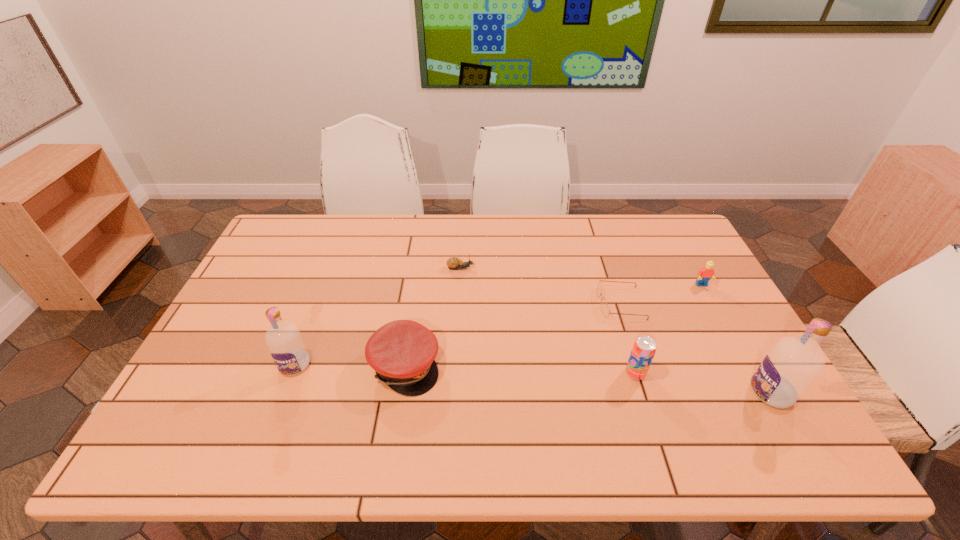
Find the location of a particular element. free area in between the spectacles and the soda can is located at coordinates (628, 338).

Choose which object is the fourth nearest neighbor to the taller vodka. Please provide its 2D coordinates. Your answer should be formatted as a tuple, i.e. [(x, y)], where the tuple contains the x and y coordinates of a point satisfying the conditions above.

[(402, 352)]

Locate which object ranks fifth in proximity to the soda can. Please provide its 2D coordinates. Your answer should be formatted as a tuple, i.e. [(x, y)], where the tuple contains the x and y coordinates of a point satisfying the conditions above.

[(453, 263)]

This screenshot has width=960, height=540. What are the coordinates of `free region that satisfies the following two spatial constraints: 1. on the back side of the fifth shortest object; 2. on the front-facing side of the escargot` in the screenshot? It's located at (602, 268).

This screenshot has width=960, height=540. I want to click on vacant space that satisfies the following two spatial constraints: 1. on the face of the Lego; 2. on the front-facing side of the spectacles, so click(711, 303).

Find the location of a particular element. Image resolution: width=960 pixels, height=540 pixels. free location that satisfies the following two spatial constraints: 1. on the front-facing side of the farthest object; 2. on the left side of the soda can is located at coordinates (456, 373).